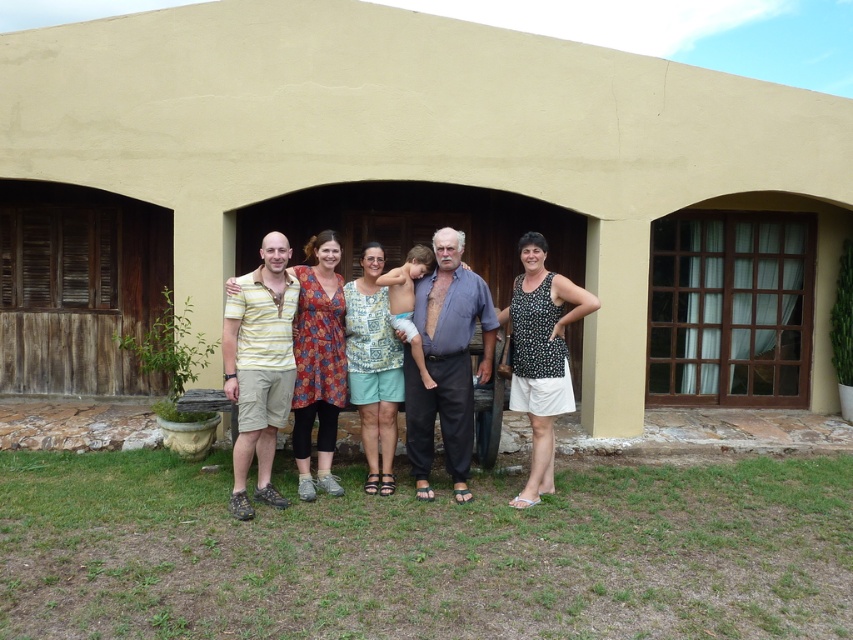
Describe the element at coordinates (445, 358) in the screenshot. This screenshot has width=853, height=640. I see `matte yellow shirt at center` at that location.

Is point (445, 378) less distant than point (576, 314)?

That is False.

The image size is (853, 640). What are the coordinates of `matte yellow shirt at center` in the screenshot? It's located at (445, 358).

The width and height of the screenshot is (853, 640). I want to click on matte yellow shirt at center, so click(x=445, y=358).

Does blue cotton shirt at center appear over black dotted tank top at center?

Indeed, blue cotton shirt at center is positioned over black dotted tank top at center.

Identify the location of blue cotton shirt at center. The image size is (853, 640). (445, 364).

Is matte yellow shirt at center bigger than blue cotton shirt at center?

Indeed, matte yellow shirt at center has a larger size compared to blue cotton shirt at center.

Can you confirm if matte yellow shirt at center is positioned to the left of blue cotton shirt at center?

Yes, matte yellow shirt at center is to the left of blue cotton shirt at center.

Describe the element at coordinates (445, 358) in the screenshot. Image resolution: width=853 pixels, height=640 pixels. I see `matte yellow shirt at center` at that location.

Identify the location of matte yellow shirt at center. (445, 358).